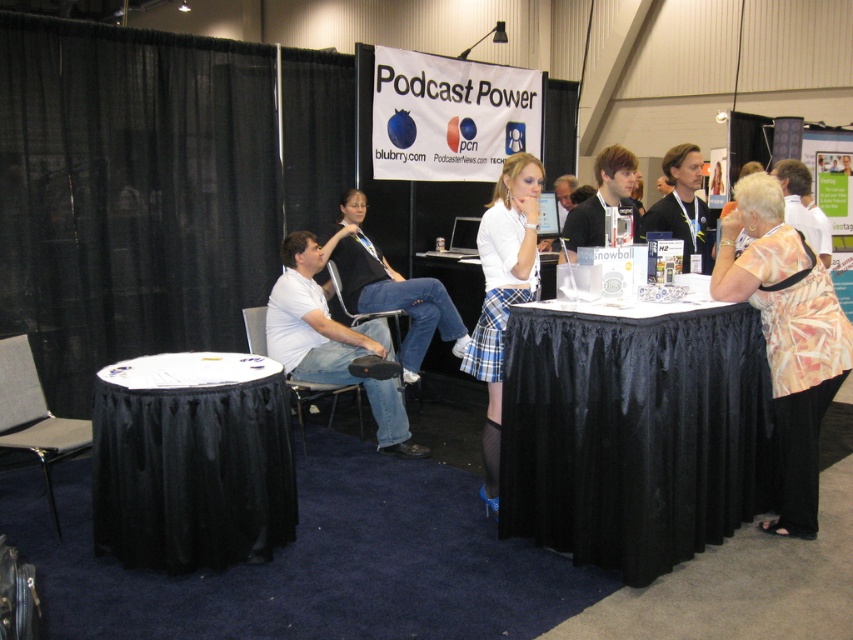
Which is in front, point (44, 428) or point (258, 323)?

Point (44, 428) is in front.

Does point (36, 374) come in front of point (344, 385)?

Yes.

You are a GUI agent. You are given a task and a screenshot of the screen. Output one action in this format:
    pyautogui.click(x=<x>, y=<y>)
    Task: Click on the gray fabric chair at lower left
    
    Given the screenshot: What is the action you would take?
    pyautogui.click(x=33, y=416)

Does white matte skirt at center appear on the left side of gray fabric chair at lower left?

No, white matte skirt at center is not to the left of gray fabric chair at lower left.

Is point (517, 298) positioned before point (30, 404)?

That is True.

I want to click on white matte skirt at center, so click(x=503, y=291).

Which is in front, point (138, 372) or point (253, 348)?

Point (138, 372) is in front.

Which is more to the right, white satin table at lower left or black fabric chair at lower left?

black fabric chair at lower left is more to the right.

Between point (138, 497) and point (254, 316), which one is positioned behind?

The point (254, 316) is more distant.

The height and width of the screenshot is (640, 853). What are the coordinates of `white satin table at lower left` in the screenshot? It's located at (190, 461).